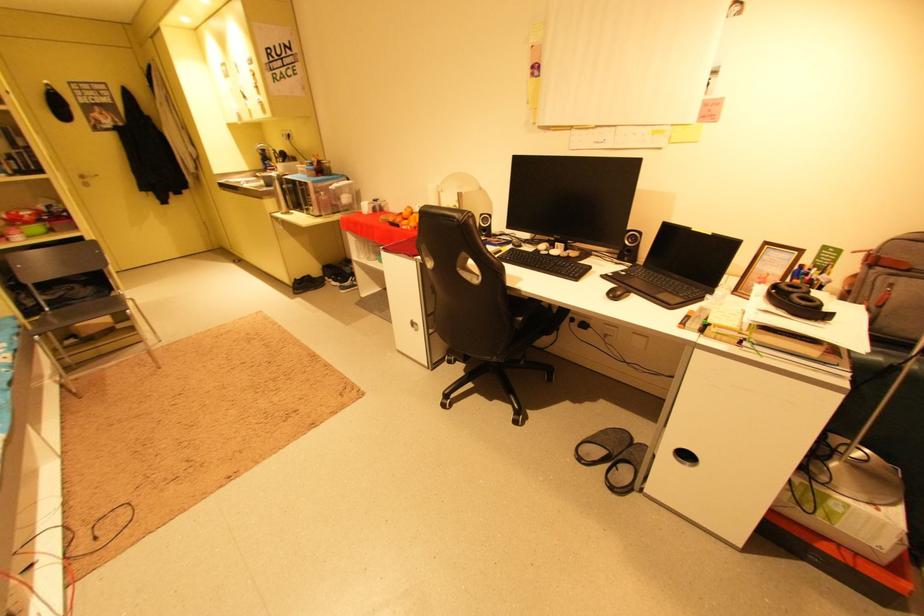
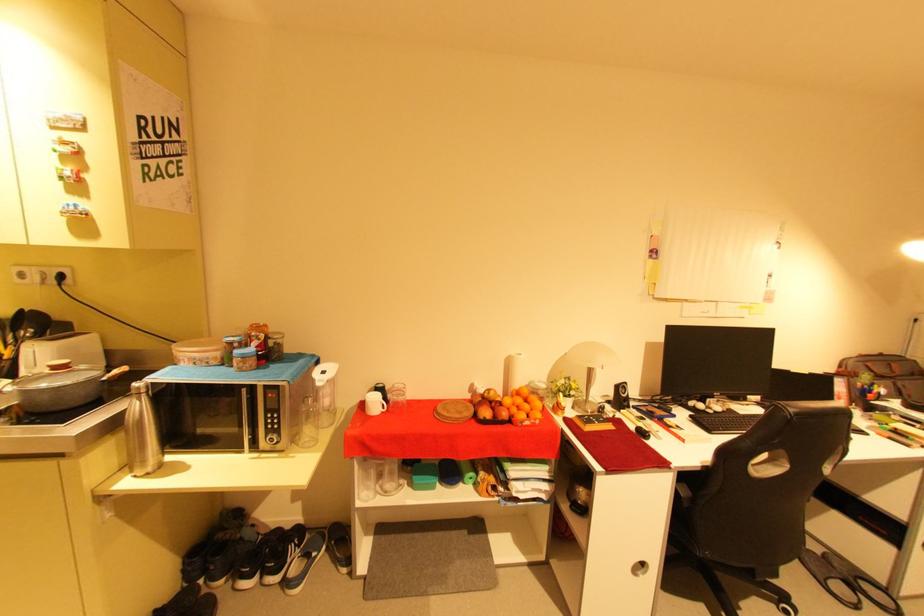
Find the pixel in the second image that matches (x=566, y=257) in the first image.

(730, 411)